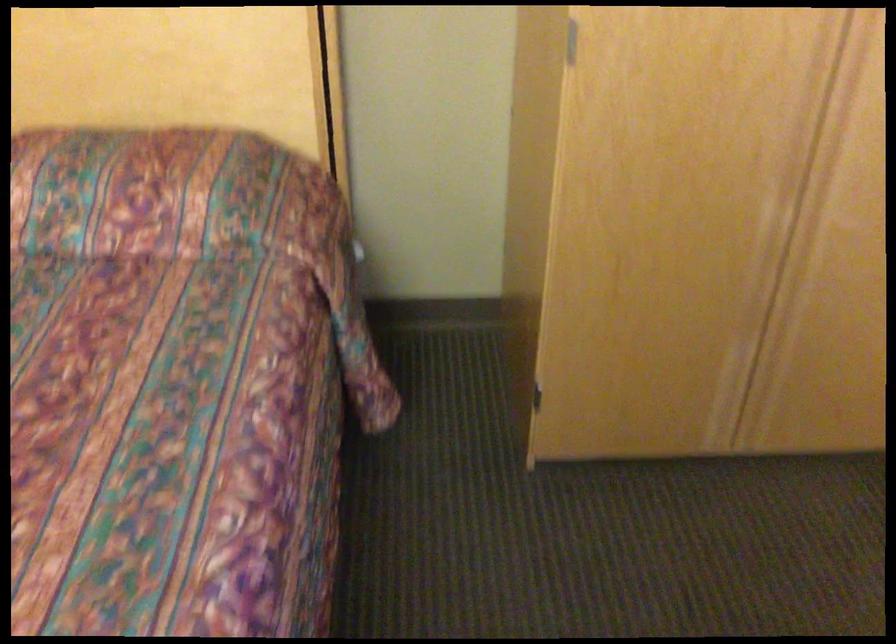
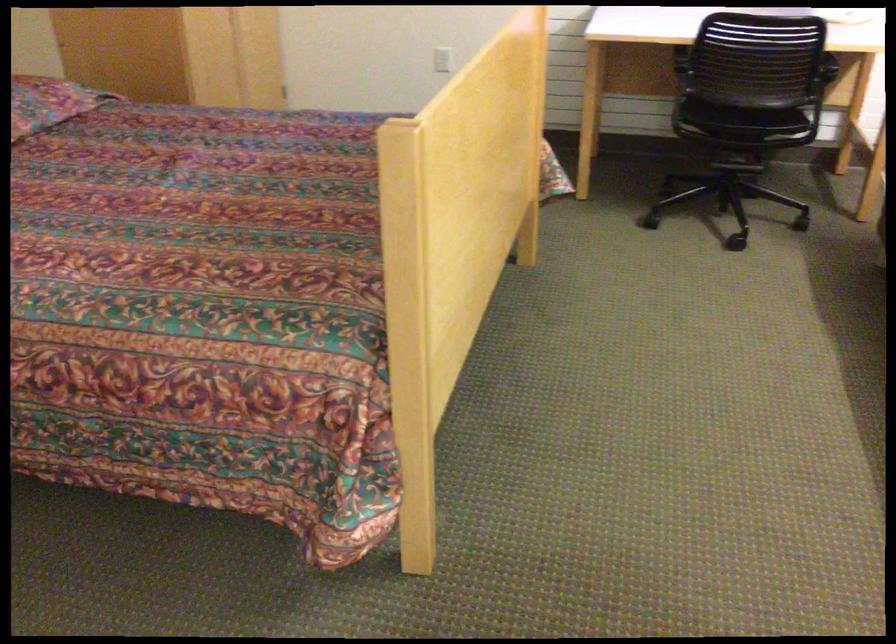
In the second image, find the point that corresponds to point (140, 207) in the first image.

(48, 102)